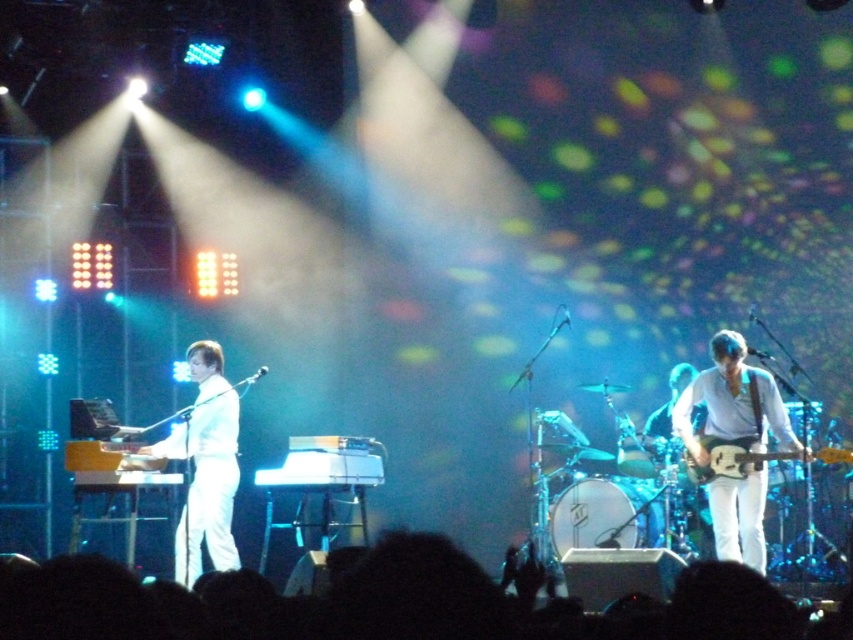
Question: Which object is farther from the camera taking this photo?

Choices:
 (A) white glossy piano at left
 (B) white matte guitar at right
 (C) electric guitar at right

Answer: (A)

Question: Considering the relative positions of white glossy piano at left and electric guitar at right in the image provided, where is white glossy piano at left located with respect to electric guitar at right?

Choices:
 (A) below
 (B) above

Answer: (A)

Question: Does white matte guitar at right appear under electric guitar at right?

Choices:
 (A) yes
 (B) no

Answer: (B)

Question: Estimate the real-world distances between objects in this image. Which object is farther from the white glossy piano at left?

Choices:
 (A) electric guitar at right
 (B) white matte guitar at right

Answer: (A)

Question: Is white matte guitar at right bigger than white glossy piano at left?

Choices:
 (A) yes
 (B) no

Answer: (A)

Question: Among these points, which one is farthest from the camera?

Choices:
 (A) (160, 444)
 (B) (752, 426)
 (C) (700, 438)

Answer: (A)